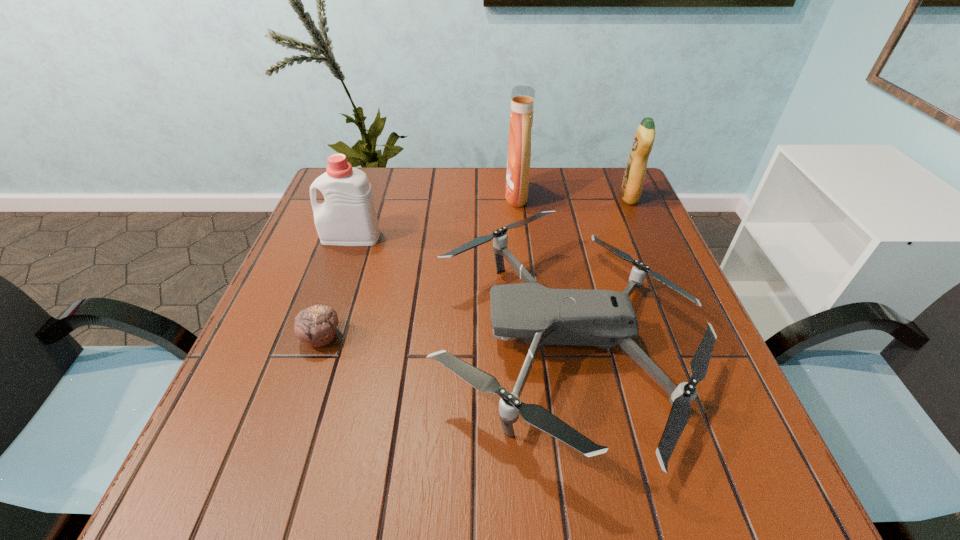
At what (x,y) coordinates should I click in order to perform the action: click on free space between the tallest detergent and the drone. Please return your answer as a coordinate pair (x, y). This screenshot has height=540, width=960. Looking at the image, I should click on (541, 268).

Identify which object is located as the second nearest to the nearest detergent. Please provide its 2D coordinates. Your answer should be formatted as a tuple, i.e. [(x, y)], where the tuple contains the x and y coordinates of a point satisfying the conditions above.

[(316, 326)]

Identify which object is the third closest to the third nearest object. Please provide its 2D coordinates. Your answer should be formatted as a tuple, i.e. [(x, y)], where the tuple contains the x and y coordinates of a point satisfying the conditions above.

[(522, 97)]

Find the location of a particular element. The height and width of the screenshot is (540, 960). the second closest detergent to the leftmost detergent is located at coordinates (631, 187).

Identify the location of the second closest detergent to the leftmost detergent. (631, 187).

This screenshot has width=960, height=540. I want to click on free spot that satisfies the following two spatial constraints: 1. on the label of the rightmost detergent; 2. on the front side of the shortest object, so click(x=692, y=338).